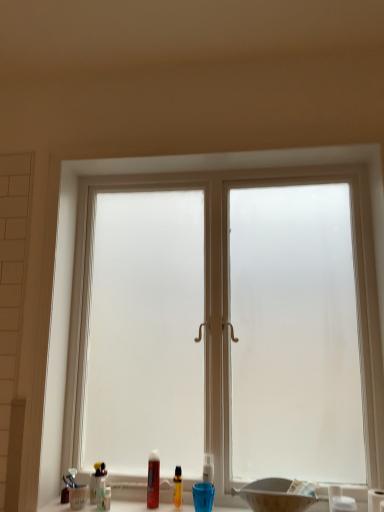
Question: Is translucent plastic toothbrush at lower center, marked as the 4th toiletry in a right-to-left arrangement, looking in the opposite direction of translucent plastic bottle at lower center, the 3th toiletry from the left?

Choices:
 (A) yes
 (B) no

Answer: (B)

Question: Does translucent plastic toothbrush at lower center, positioned as the second toiletry in front-to-back order, come in front of translucent plastic bottle at lower center, placed as the 3th toiletry when sorted from front to back?

Choices:
 (A) no
 (B) yes

Answer: (B)

Question: From a real-world perspective, is translucent plastic toothbrush at lower center, which is the third toiletry in back-to-front order, positioned over translucent plastic bottle at lower center, placed as the 3th toiletry when sorted from front to back, based on gravity?

Choices:
 (A) yes
 (B) no

Answer: (B)

Question: Is translucent plastic bottle at lower center, placed as the 3th toiletry when sorted from front to back, inside translucent plastic toothbrush at lower center, positioned as the second toiletry in front-to-back order?

Choices:
 (A) no
 (B) yes

Answer: (A)

Question: From the image's perspective, is translucent plastic toothbrush at lower center, positioned as the second toiletry in front-to-back order, under translucent plastic bottle at lower center, the 3th toiletry from the left?

Choices:
 (A) no
 (B) yes

Answer: (B)

Question: From the image's perspective, is translucent plastic bottle at center, the second toiletry when ordered from left to right, positioned above or below translucent plastic bottle at lower center, the 3th toiletry from the left?

Choices:
 (A) above
 (B) below

Answer: (A)

Question: From a real-world perspective, is translucent plastic bottle at center, arranged as the fourth toiletry when viewed from the front, above or below translucent plastic bottle at lower center, positioned as the second toiletry in back-to-front order?

Choices:
 (A) below
 (B) above

Answer: (B)

Question: In the image, is translucent plastic bottle at center, arranged as the fourth toiletry when viewed from the front, positioned in front of or behind translucent plastic bottle at lower center, positioned as the second toiletry in back-to-front order?

Choices:
 (A) front
 (B) behind

Answer: (B)

Question: Looking at their shapes, would you say translucent plastic bottle at center, the 1th toiletry when ordered from back to front, is wider or thinner than translucent plastic bottle at lower center, which appears as the 2th toiletry when viewed from the right?

Choices:
 (A) thin
 (B) wide

Answer: (B)

Question: From their relative heights in the image, would you say white matte toilet paper at right is taller or shorter than frosted glass window at center?

Choices:
 (A) tall
 (B) short

Answer: (B)

Question: From the image's perspective, relative to frosted glass window at center, is white matte toilet paper at right above or below?

Choices:
 (A) below
 (B) above

Answer: (A)

Question: Considering the relative positions of white matte toilet paper at right and frosted glass window at center in the image provided, is white matte toilet paper at right to the left or to the right of frosted glass window at center?

Choices:
 (A) right
 (B) left

Answer: (A)

Question: Is point (380, 497) closer or farther from the camera than point (382, 361)?

Choices:
 (A) farther
 (B) closer

Answer: (B)

Question: Based on their sizes in the image, would you say white plastic toothbrush at lower center, which appears as the first toiletry when viewed from the right, is bigger or smaller than translucent plastic bottles at lower center?

Choices:
 (A) small
 (B) big

Answer: (A)

Question: In terms of height, does white plastic toothbrush at lower center, which is counted as the fourth toiletry, starting from the left, look taller or shorter compared to translucent plastic bottles at lower center?

Choices:
 (A) tall
 (B) short

Answer: (A)